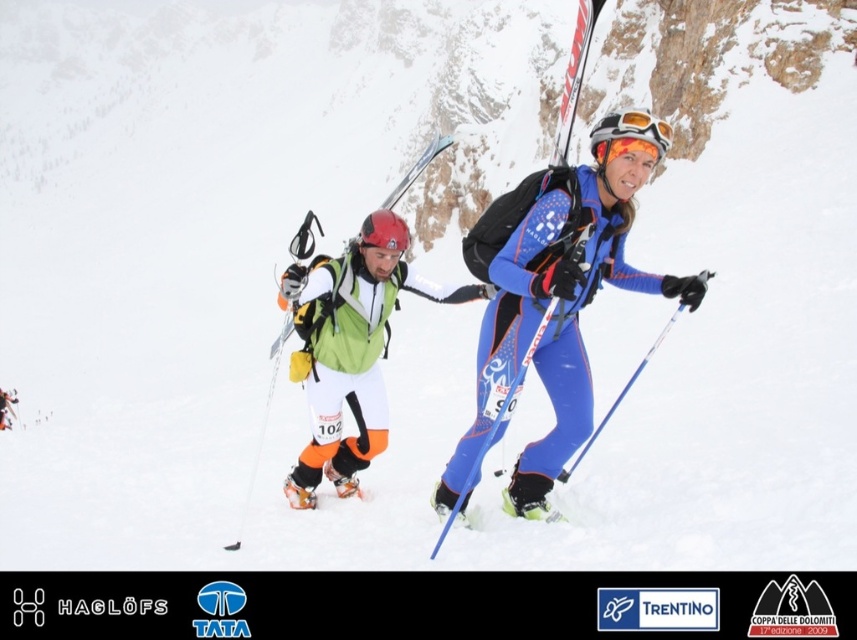
You are a photographer standing at the starting line of the cross country ski race. You want to take a photo that includes both the point at (313, 218) and the point at (658, 131). Which point is closer to the camera so you can adjust your focus accordingly?

Point at (658, 131) is closer to the camera than point at (313, 218), so focus on that point first.

You are a photographer positioned at the camera location. You want to capture a closeup shot of the green fabric jacket at center. Considering the jacket is 37.91 meters away, can you use a standard zoom lens with a maximum range of 100mm to achieve this?

The green fabric jacket at center is 37.91 meters away from the camera. A standard zoom lens with a maximum range of 100mm may not provide sufficient magnification to capture a closeup of the jacket from that distance. A telephoto lens with a longer focal length would be more appropriate for this scenario.

You are a spectator at the ski race and want to take a photo of both the green fabric jacket at center and the orange reflective goggles at center. Which object should you focus on first to ensure both are in the frame?

The green fabric jacket at center is below orange reflective goggles at center, so focus on the orange reflective goggles at center first to ensure both are in the frame.